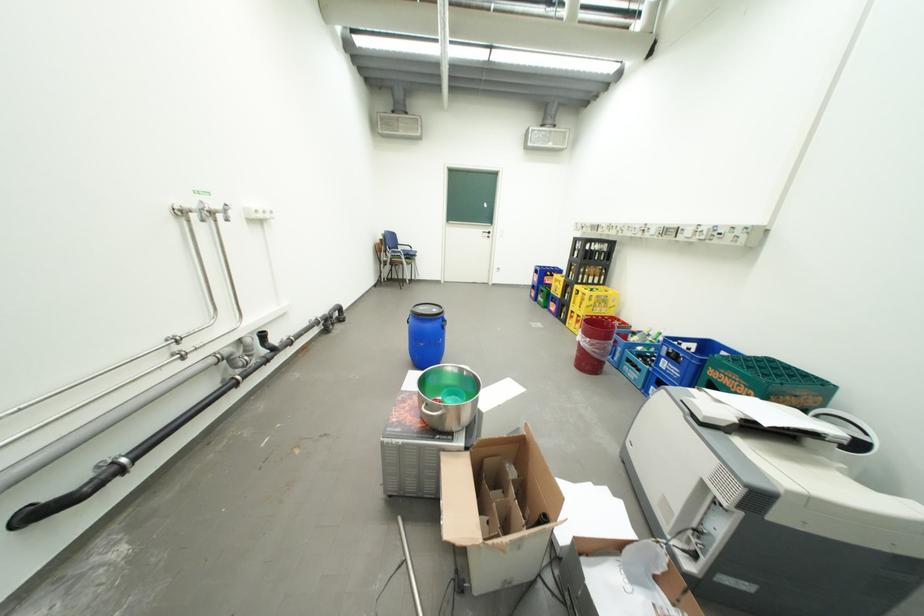
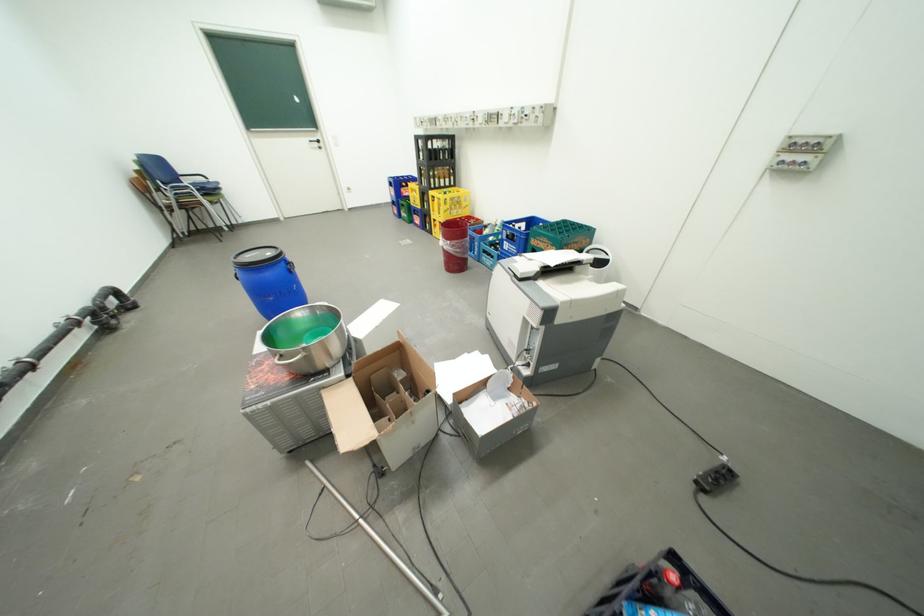
Where in the second image is the point corresponding to the point at 524,483 from the first image?

(410, 382)